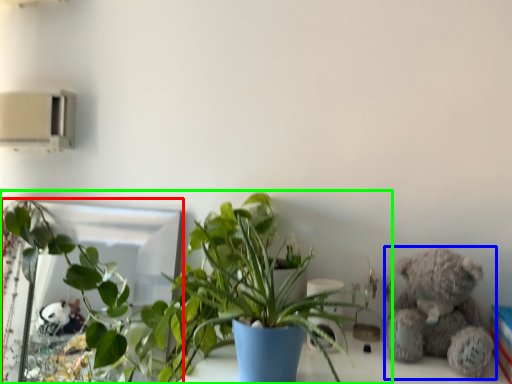
Question: Which object is positioned closest to mirror (highlighted by a red box)? Select from teddy bear (highlighted by a blue box) and houseplant (highlighted by a green box).

Choices:
 (A) teddy bear
 (B) houseplant

Answer: (B)